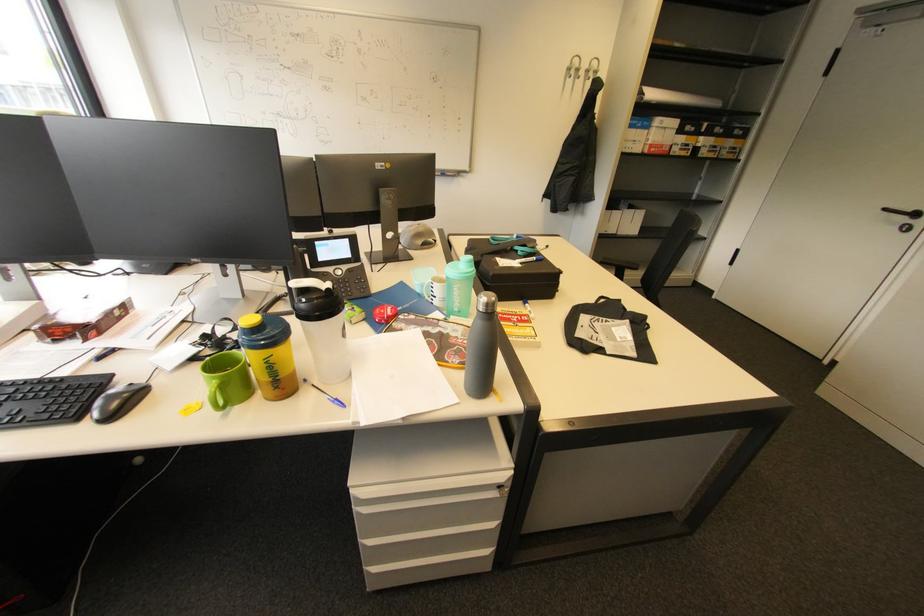
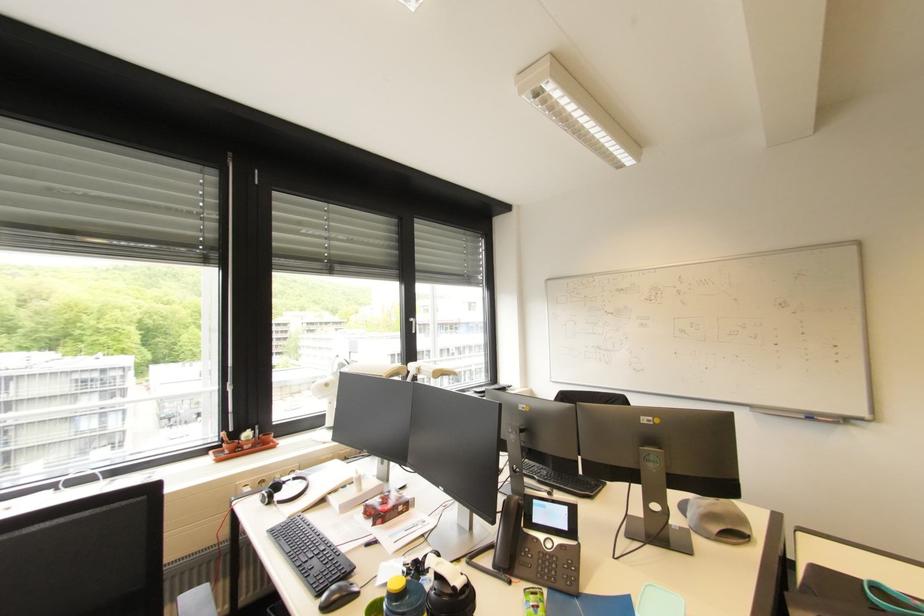
The point at [117,418] is marked in the first image. Where is the corresponding point in the second image?

(332, 609)